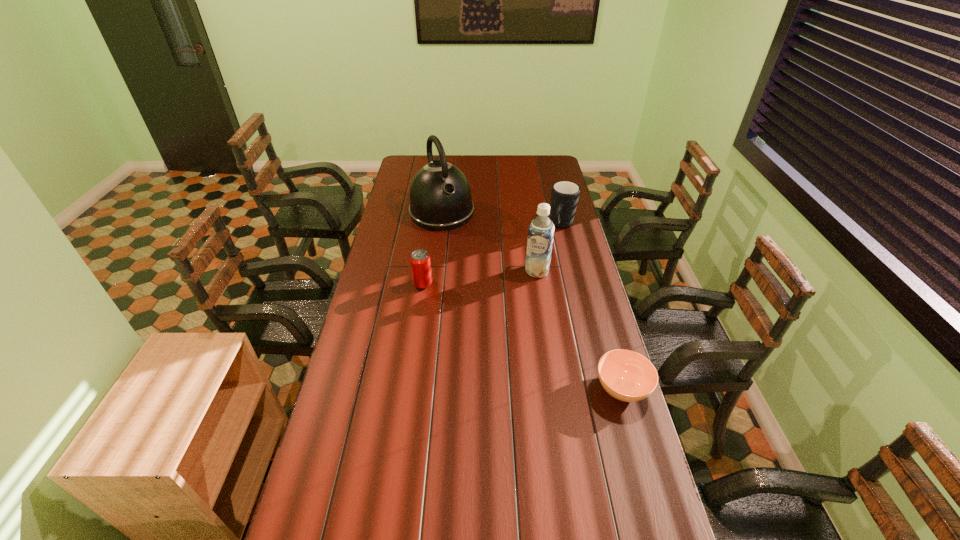
Find the location of a particular element. The width and height of the screenshot is (960, 540). free space between the tallest object and the third shortest object is located at coordinates (502, 219).

Identify the location of vacant space that is in between the nearest object and the soya milk. The height and width of the screenshot is (540, 960). (580, 330).

Locate an element on the screen. unoccupied area between the mug and the tallest object is located at coordinates (502, 219).

Where is `blank region between the shortest object and the third shortest object`? This screenshot has width=960, height=540. blank region between the shortest object and the third shortest object is located at coordinates (592, 307).

Find the location of `the third closest object to the shortest object`. the third closest object to the shortest object is located at coordinates (564, 194).

Where is `the second closest object to the can`? This screenshot has width=960, height=540. the second closest object to the can is located at coordinates (x=541, y=231).